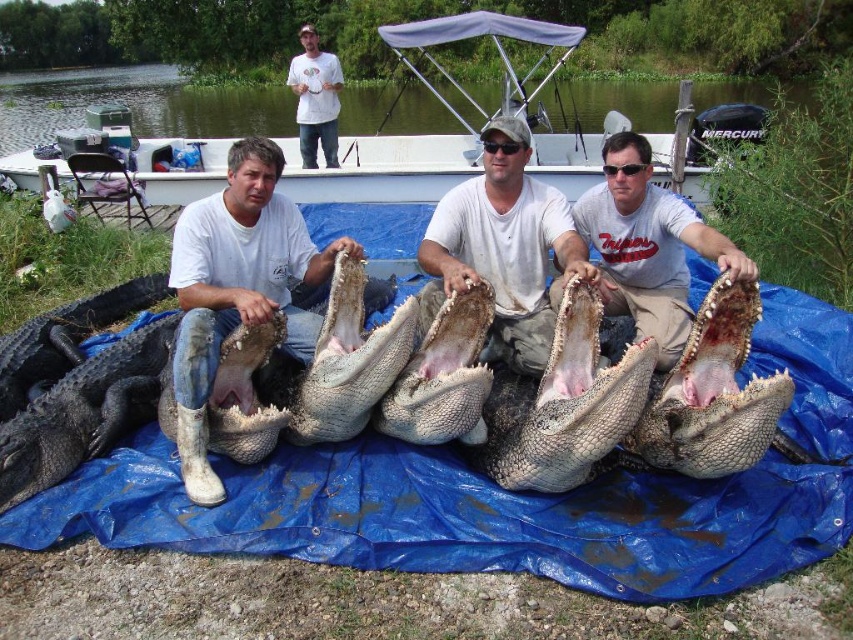
You are standing on the bank of the lake and see the white plastic boat at center and the gray matte shirt at center. Which object is higher in elevation?

The white plastic boat at center is above the gray matte shirt at center, so it is higher in elevation.

You are a wildlife photographer aiming to capture the alligators in the image. You notice a dark gray scaly crocodile at center located at point (86, 412). Where would you position your camera to ensure it is directly facing this crocodile?

Position your camera directly at point (86, 412) to face the dark gray scaly crocodile at center.

You are a photographer trying to capture a clear shot of the white plastic boat at center and the white matte shirt at center. Which object will appear larger in the photo due to its height?

The white plastic boat at center is much taller than the white matte shirt at center, so it will appear larger in the photo.